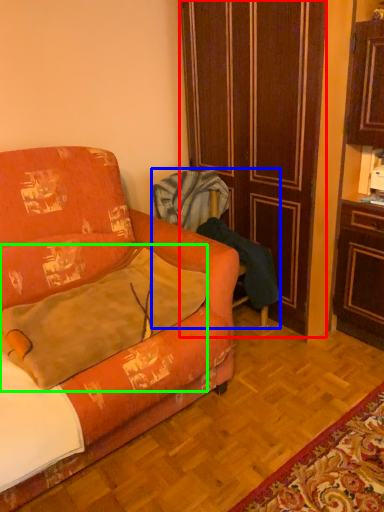
Question: Which object is positioned closest to door (highlighted by a red box)? Select from armchair (highlighted by a blue box) and throw pillow (highlighted by a green box).

Choices:
 (A) armchair
 (B) throw pillow

Answer: (A)